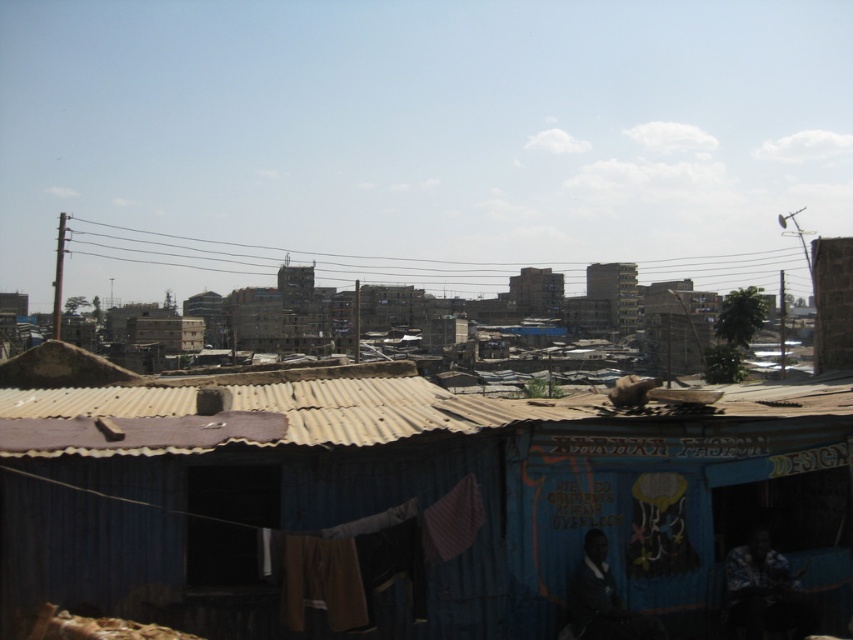
You are a delivery person trying to navigate through the urban area. You need to deliver a package to the blue corrugated metal hut at center. According to the coordinates provided, is the hut located closer to the top or bottom of the image?

The blue corrugated metal hut at center is located at point [404,502]. Since the y coordinate is 0.475, which is closer to 0.5, it is approximately in the middle vertically. However, since the question asks whether it is closer to the top or bottom, 0.475 is just below the halfway point, so it is slightly closer to the bottom of the image.

You are standing at point (x=627, y=417) and want to walk to point (x=13, y=385). Based on the scene description, will you be moving towards the foreground or the background?

Since point (x=13, y=385) is behind point (x=627, y=417), moving from (x=627, y=417) to (x=13, y=385) would mean moving further into the background.